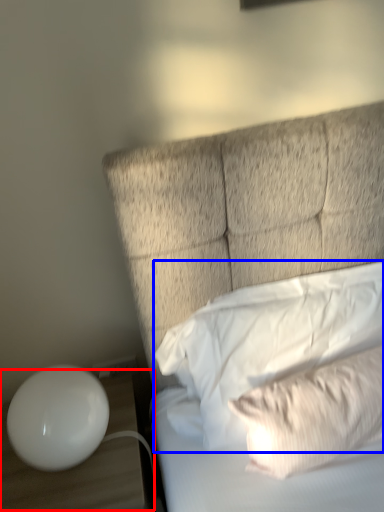
Question: Among these objects, which one is nearest to the camera, table (highlighted by a red box) or pillow (highlighted by a blue box)?

Choices:
 (A) table
 (B) pillow

Answer: (B)